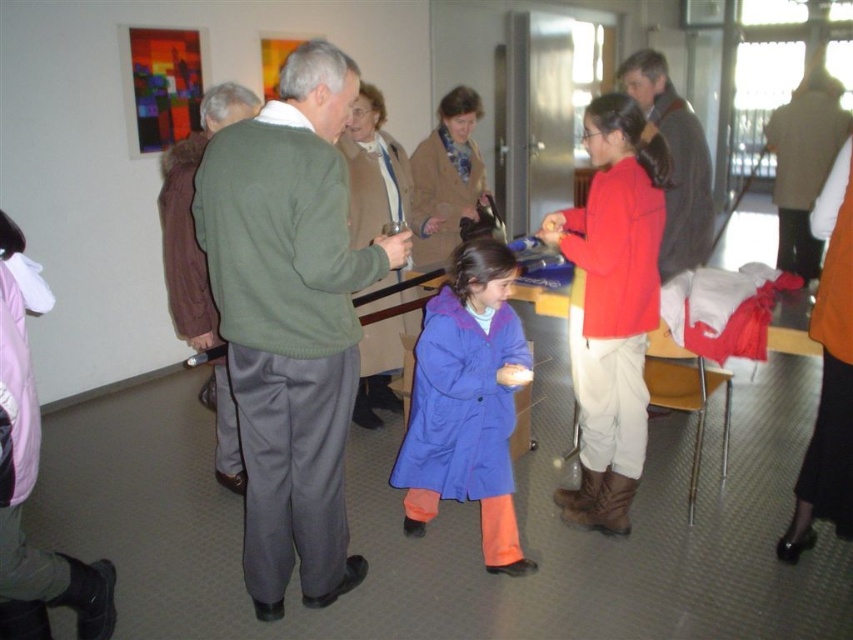
Question: Which of the following is the closest to the observer?

Choices:
 (A) (672, 122)
 (B) (428, 499)
 (C) (321, 531)

Answer: (C)

Question: Is green sweater at center to the right of dark gray sweater at upper right from the viewer's perspective?

Choices:
 (A) yes
 (B) no

Answer: (B)

Question: Which point appears closest to the camera in this image?

Choices:
 (A) click(x=601, y=230)
 (B) click(x=697, y=120)
 (C) click(x=316, y=250)

Answer: (C)

Question: Observing the image, what is the correct spatial positioning of green sweater at center in reference to dark gray sweater at upper right?

Choices:
 (A) right
 (B) left

Answer: (B)

Question: Estimate the real-world distances between objects in this image. Which object is farther from the green fabric jacket at center?

Choices:
 (A) green sweater at center
 (B) matte red jacket at center
 (C) dark gray sweater at upper right
 (D) matte blue coat at center

Answer: (C)

Question: Considering the relative positions of green fabric jacket at center and dark gray sweater at upper right in the image provided, where is green fabric jacket at center located with respect to dark gray sweater at upper right?

Choices:
 (A) above
 (B) below

Answer: (B)